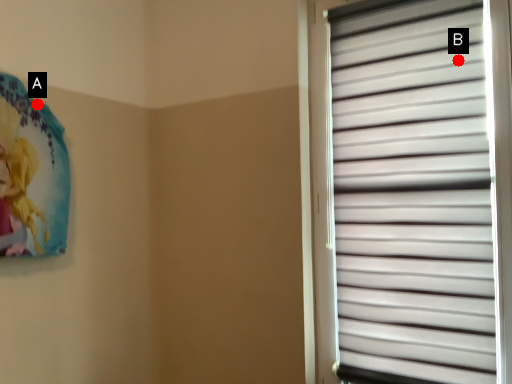
Question: Two points are circled on the image, labeled by A and B beside each circle. Which point is further to the camera?

Choices:
 (A) A is further
 (B) B is further

Answer: (A)